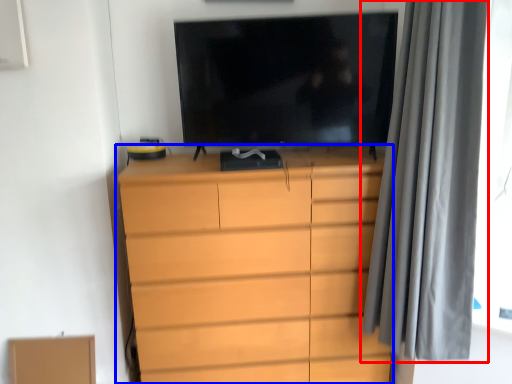
Question: Which object is further to the camera taking this photo, curtain (highlighted by a red box) or chest of drawers (highlighted by a blue box)?

Choices:
 (A) curtain
 (B) chest of drawers

Answer: (B)